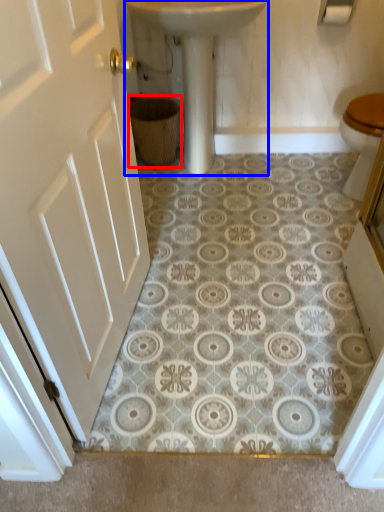
Question: Which point is further to the camera, basket (highlighted by a red box) or sink (highlighted by a blue box)?

Choices:
 (A) basket
 (B) sink

Answer: (A)